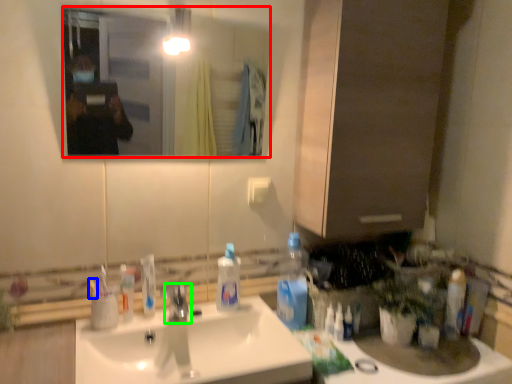
Question: Which object is positioned farthest from mirror (highlighted by a red box)? Select from toothbrush (highlighted by a blue box) and tap (highlighted by a green box).

Choices:
 (A) toothbrush
 (B) tap

Answer: (A)